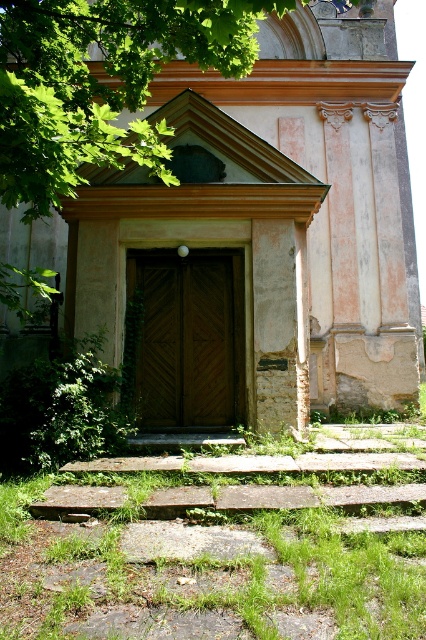
Question: Which of these objects is positioned closest to the green leafy tree at upper left?

Choices:
 (A) wooden door at center
 (B) brown wooden door at center

Answer: (B)

Question: Which point appears farthest from the camera in this image?

Choices:
 (A) (17, 138)
 (B) (184, 99)
 (C) (181, 392)

Answer: (B)

Question: Is wooden door at center bigger than brown wooden door at center?

Choices:
 (A) no
 (B) yes

Answer: (A)

Question: Which point is closer to the camera?

Choices:
 (A) (181, 376)
 (B) (164, 156)
 (C) (416, 352)

Answer: (B)

Question: Where is wooden door at center located in relation to green leafy tree at upper left in the image?

Choices:
 (A) below
 (B) above

Answer: (A)

Question: Does wooden door at center have a smaller size compared to green leafy tree at upper left?

Choices:
 (A) yes
 (B) no

Answer: (A)